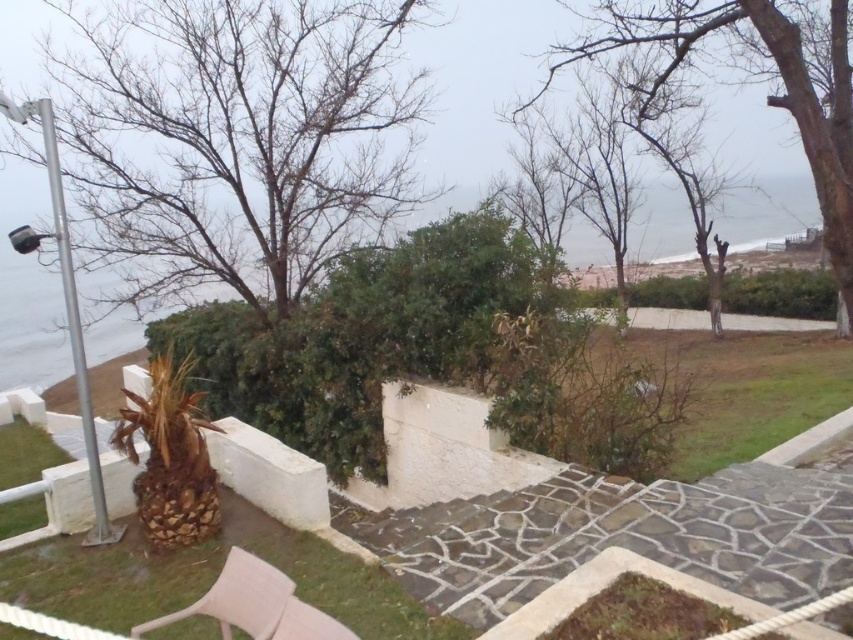
Question: Does bare branches at upper left appear on the left side of beige fabric chair at lower center?

Choices:
 (A) no
 (B) yes

Answer: (B)

Question: Which point is farther to the camera?

Choices:
 (A) (294, 609)
 (B) (166, 173)
 (C) (622, 28)

Answer: (C)

Question: Among these points, which one is nearest to the camera?

Choices:
 (A) (834, 148)
 (B) (149, 113)

Answer: (A)

Question: Can you confirm if bare branches at upper left is positioned to the left of beige fabric chair at lower center?

Choices:
 (A) yes
 (B) no

Answer: (A)

Question: Which of the following is the farthest from the observer?

Choices:
 (A) bare branches at upper left
 (B) bare wood tree at upper center

Answer: (A)

Question: Does bare wood tree at upper center appear under beige fabric chair at lower center?

Choices:
 (A) no
 (B) yes

Answer: (A)